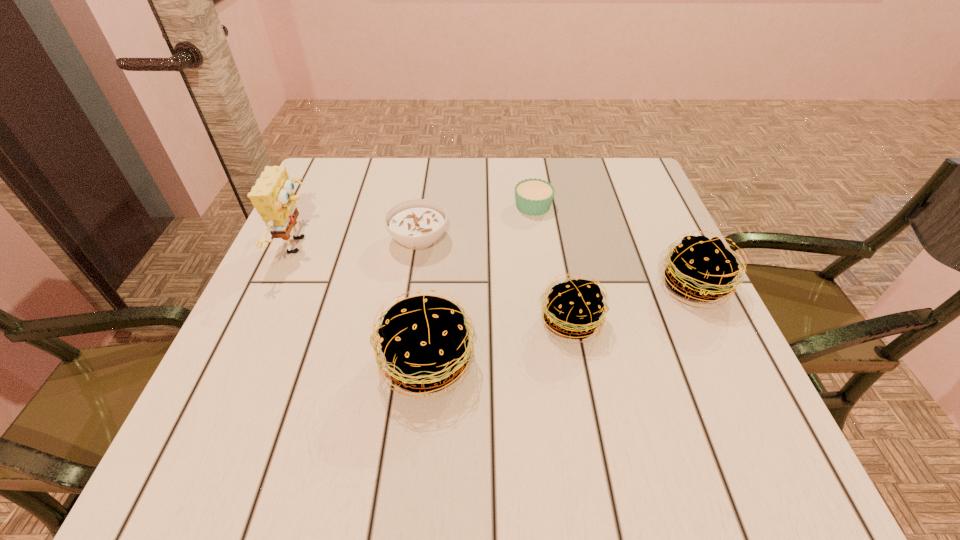
Locate an element on the screen. vacant point located on the right of the fourth tallest object is located at coordinates (698, 321).

Identify the location of vacant space located 0.180m on the front of the rightmost patty. The width and height of the screenshot is (960, 540). (746, 396).

The width and height of the screenshot is (960, 540). In order to click on vacant region located 0.350m on the left of the cupcake in this screenshot , I will do `click(373, 206)`.

Where is `free space located on the front of the soup bowl`? This screenshot has height=540, width=960. free space located on the front of the soup bowl is located at coordinates (405, 329).

Where is `free space located on the face of the sponge`? free space located on the face of the sponge is located at coordinates [x=419, y=246].

This screenshot has height=540, width=960. What are the coordinates of `object positioned at the far edge` in the screenshot? It's located at (534, 196).

Find the location of a particular element. The height and width of the screenshot is (540, 960). object located at the near edge is located at coordinates point(424,340).

Locate an element on the screen. object that is positioned at the left edge is located at coordinates (273, 197).

Locate an element on the screen. Image resolution: width=960 pixels, height=540 pixels. object present at the right edge is located at coordinates (701, 269).

The width and height of the screenshot is (960, 540). What are the coordinates of `free space at the far edge of the desktop` in the screenshot? It's located at coord(410,168).